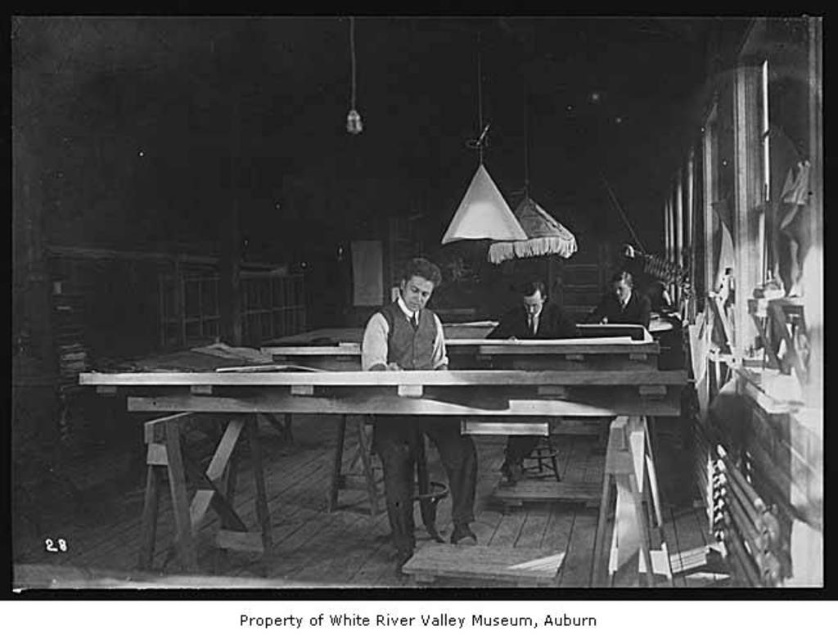
At what (x,y) coordinates should I click in order to perform the action: click on smooth wood table at center. Please return your answer as a coordinate pair (x, y). This screenshot has width=838, height=640. Looking at the image, I should click on (411, 474).

Which is behind, point (588, 397) or point (504, 468)?

Positioned behind is point (504, 468).

Is wooden table at center closer to camera compared to smooth wooden desk at center?

Yes, it is.

Image resolution: width=838 pixels, height=640 pixels. What do you see at coordinates (419, 387) in the screenshot?
I see `wooden table at center` at bounding box center [419, 387].

In order to click on wooden table at center in this screenshot , I will do pyautogui.click(x=419, y=387).

Is wooden table at center to the right of smooth wood table at center from the viewer's perspective?

No, wooden table at center is not to the right of smooth wood table at center.

Based on the photo, can you confirm if wooden table at center is positioned to the left of smooth wood table at center?

Indeed, wooden table at center is positioned on the left side of smooth wood table at center.

Which is behind, point (604, 349) or point (376, 440)?

The point (604, 349) is behind.

Locate an element on the screen. The image size is (838, 640). wooden table at center is located at coordinates (419, 387).